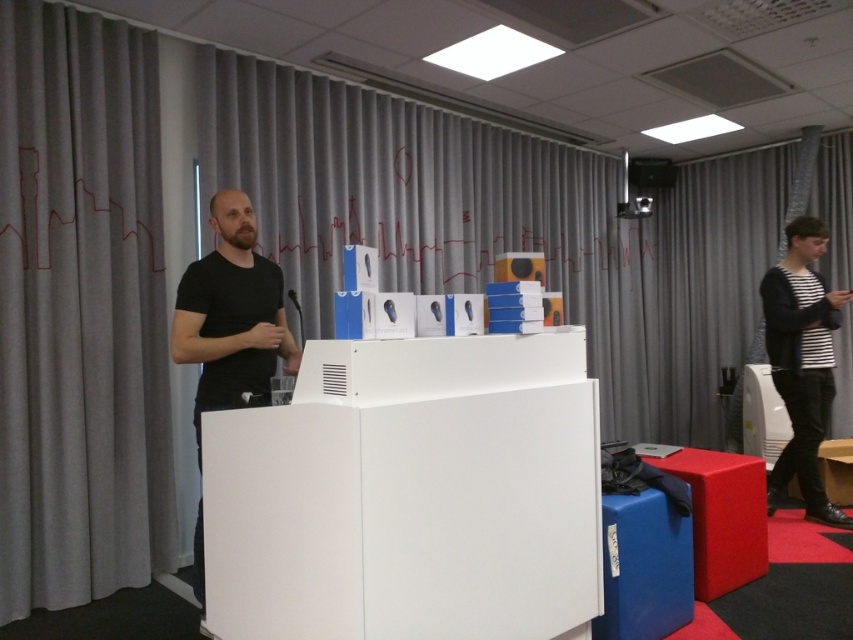
You are an event organizer setting up for a tech showcase. You have a limited space on the podium. Which object, the black matte shirt at center or the matte black speaker at upper center, has a larger width and should be placed first to optimize space?

The black matte shirt at center might be wider than the matte black speaker at upper center, so it should be placed first to accommodate its width.

Based on the photo, you are standing in the presentation room and want to reach two points marked in the scene. The first point is at coordinates point (212,360) and the second is at point (628,209). Which point is closer to you?

Point (212,360) is closer to the viewer than point (628,209).

You are setting up for a presentation and need to place a large laptop between the rubberized red stool at lower right and the matte black projector at upper center. Based on their widths, will there be enough space for the laptop?

The rubberized red stool at lower right might be wider than the matte black projector at upper center, so there may not be enough space for the laptop between them. Check their exact widths before placing the laptop.